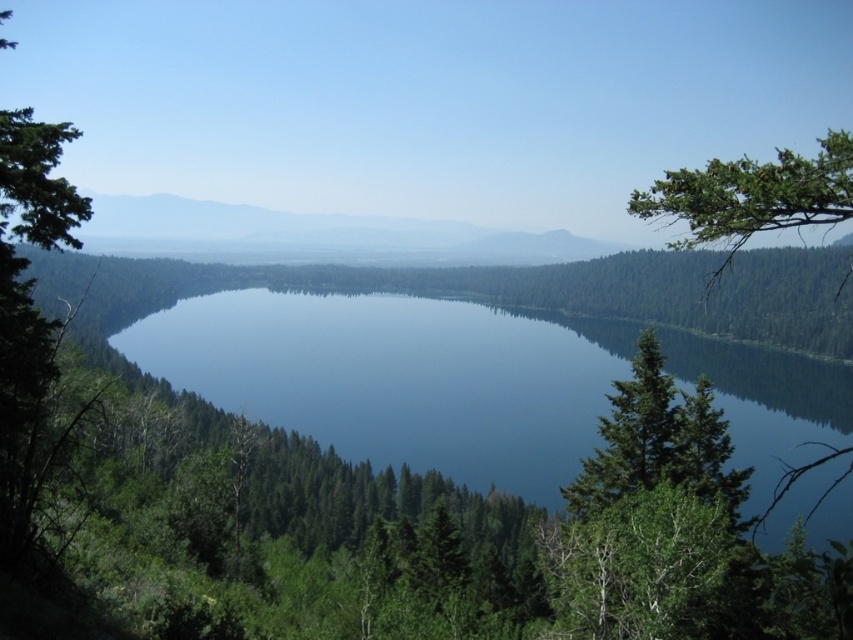
You are standing at the edge of the forest looking towards the lake and mountains. You see the blue reflective water at center and the smooth gray mountain at center. Which object is located to the right of the other?

The blue reflective water at center is positioned on the right side of smooth gray mountain at center.

You are standing at the edge of the lake and want to walk to the green matte tree at right. Which direction should you head towards from the blue reflective water at center?

You should head to the right from the blue reflective water at center to reach the green matte tree at right since the blue reflective water at center is located to the left of the green matte tree at right.